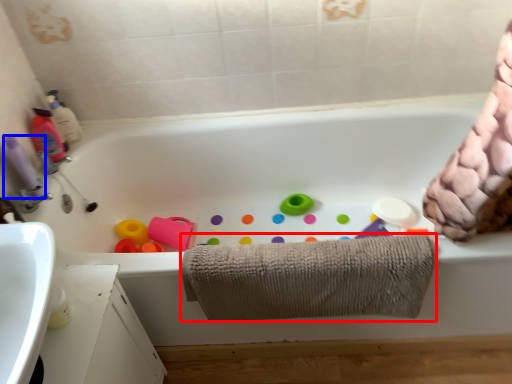
Question: Among these objects, which one is nearest to the camera, towel (highlighted by a red box) or cleaning product (highlighted by a blue box)?

Choices:
 (A) towel
 (B) cleaning product

Answer: (A)